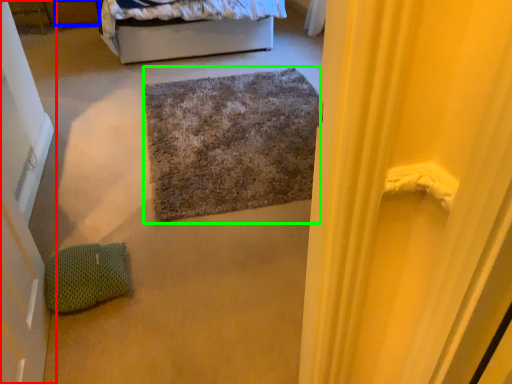
Question: Based on their relative distances, which object is nearer to door (highlighted by a red box)? Choose from drawer (highlighted by a blue box) and doormat (highlighted by a green box).

Choices:
 (A) drawer
 (B) doormat

Answer: (B)